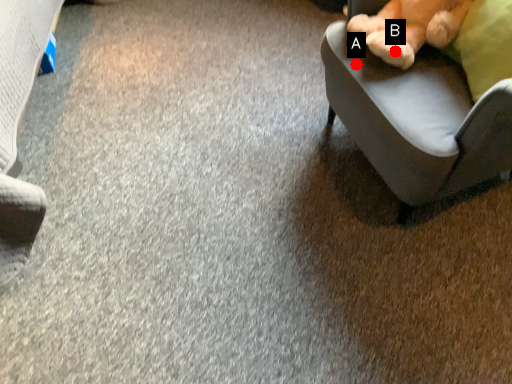
Question: Two points are circled on the image, labeled by A and B beside each circle. Which point is farther from the camera taking this photo?

Choices:
 (A) A is further
 (B) B is further

Answer: (A)